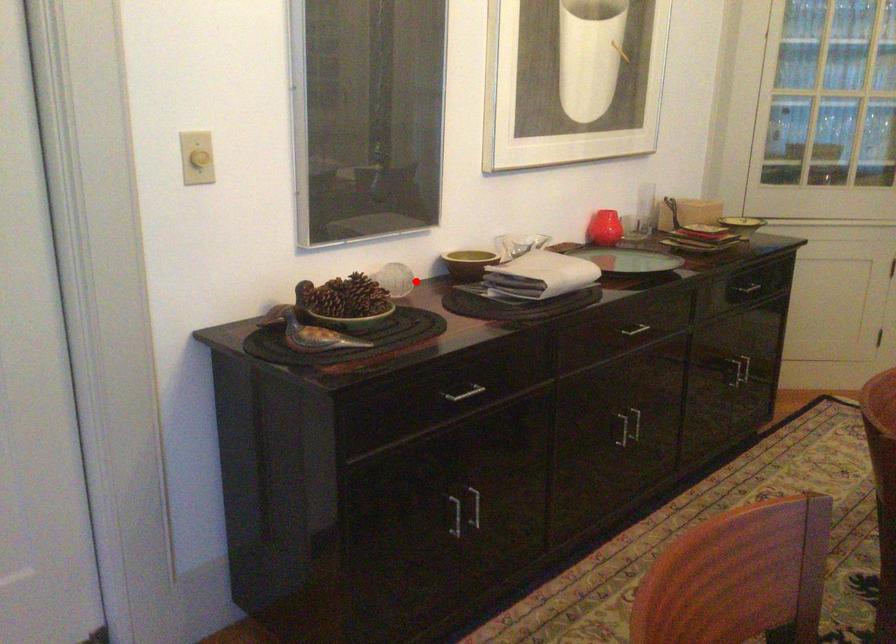
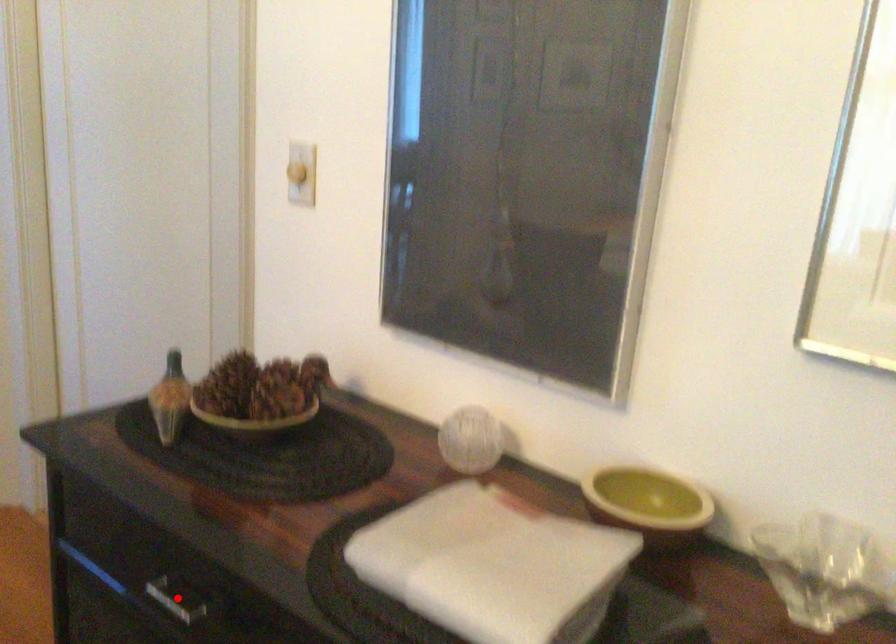
I am providing you with two images of the same scene from different viewpoints. A red point is marked on the first image and another point is marked on the second image. Is the red point in image1 aligned with the point shown in image2?

No